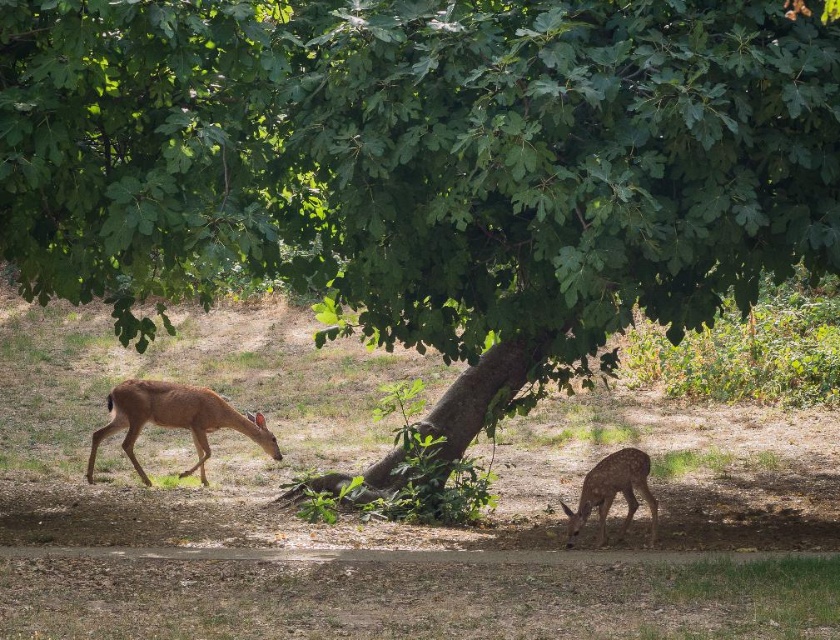
Question: Which of the following is the closest to the observer?

Choices:
 (A) brown matte/deer at left
 (B) brown matte/deer at lower right

Answer: (B)

Question: Does brown matte/deer at left have a smaller size compared to brown matte/deer at lower right?

Choices:
 (A) no
 (B) yes

Answer: (A)

Question: Which point appears closest to the camera in this image?

Choices:
 (A) click(x=630, y=474)
 (B) click(x=124, y=420)

Answer: (A)

Question: Which object is closer to the camera taking this photo?

Choices:
 (A) brown matte/deer at left
 (B) brown matte/deer at lower right

Answer: (B)

Question: Can you confirm if brown matte/deer at left is smaller than brown matte/deer at lower right?

Choices:
 (A) yes
 (B) no

Answer: (B)

Question: Can you confirm if brown matte/deer at left is wider than brown matte/deer at lower right?

Choices:
 (A) no
 (B) yes

Answer: (B)